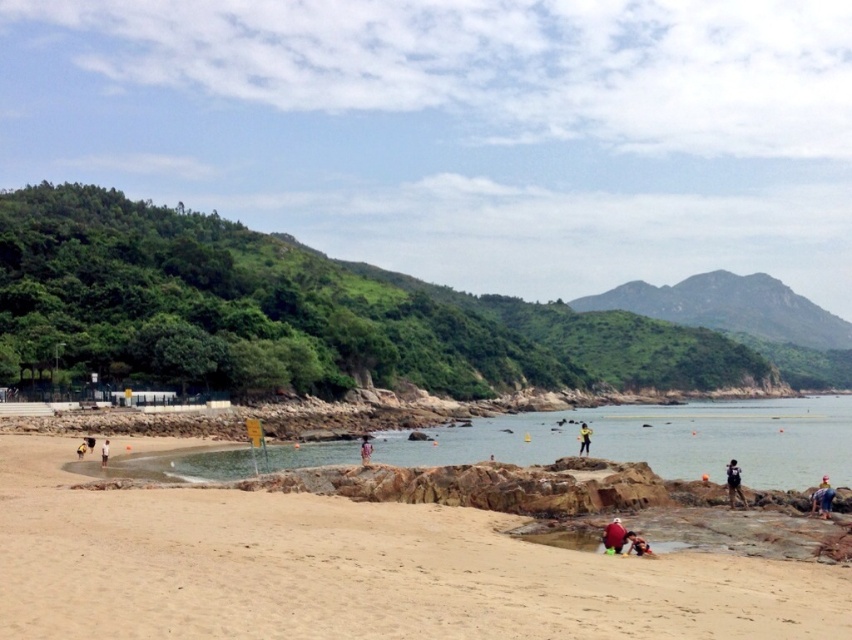
Question: Is clear water at center behind dark blue shirt at lower left?

Choices:
 (A) yes
 (B) no

Answer: (B)

Question: Which of these objects is positioned closest to the dark blue shirt at lower left?

Choices:
 (A) sandy beach at lower left
 (B) yellow fabric person at center
 (C) blue fabric umbrella at center

Answer: (C)

Question: Where is sandy beach at lower left located in relation to dark blue shirt at lower left in the image?

Choices:
 (A) right
 (B) left

Answer: (A)

Question: Which point is closer to the camera?

Choices:
 (A) (101, 444)
 (B) (366, 448)
 (C) (90, 442)
 (D) (622, 541)

Answer: (D)

Question: Which object appears farthest from the camera in this image?

Choices:
 (A) blue fabric umbrella at center
 (B) dark blue shirt at lower left

Answer: (B)

Question: Can you confirm if blue denim shorts at lower right is smaller than red fabric person at lower center?

Choices:
 (A) yes
 (B) no

Answer: (B)